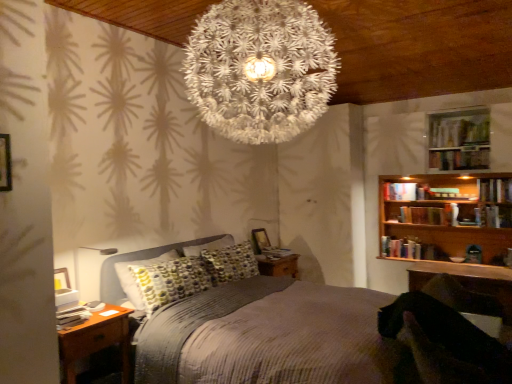
Question: Would you say wooden table at lower right is to the left or to the right of hardcover book at upper right, the second book positioned from the top, in the picture?

Choices:
 (A) left
 (B) right

Answer: (A)

Question: In the image, is wooden table at lower right positioned in front of or behind hardcover book at upper right, the sixth book in the left-to-right sequence?

Choices:
 (A) front
 (B) behind

Answer: (A)

Question: Estimate the real-world distances between objects in this image. Which object is farther from the brown wood nightstand at lower left?

Choices:
 (A) wooden bookshelf at upper right
 (B) hardcover book at upper right, which is the first book from right to left
 (C) textured gray bed at center
 (D) hardcover book at center, which ranks as the sixth book in right-to-left order
 (E) hardcover book at upper right, positioned as the third book in right-to-left order

Answer: (B)

Question: Which object is positioned closest to the white paper-like at center?

Choices:
 (A) hardcover book at upper right, the first book when ordered from top to bottom
 (B) wooden table at lower right
 (C) wooden bookshelf at upper right
 (D) textured gray bed at center
 (E) hardcover book at center, the first book from the bottom

Answer: (D)